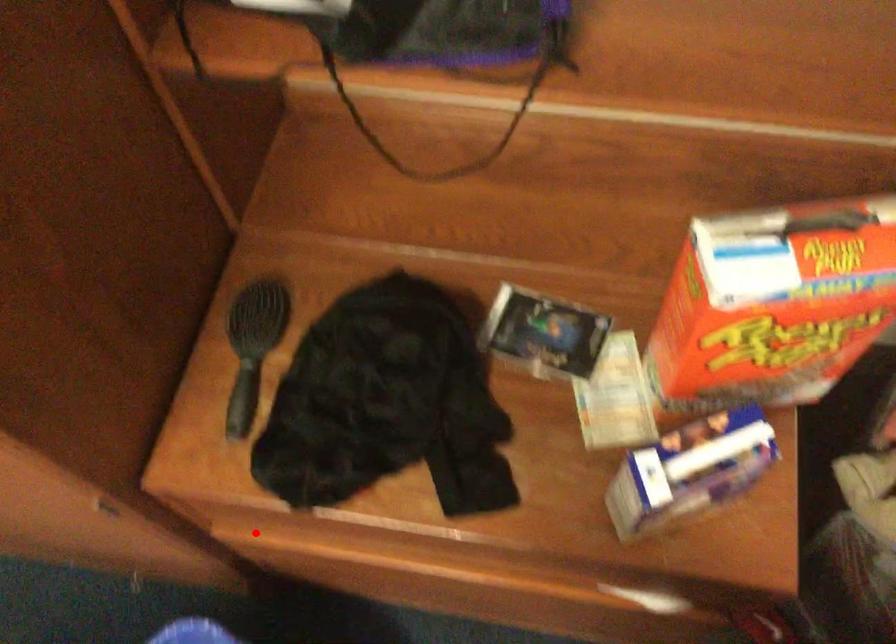
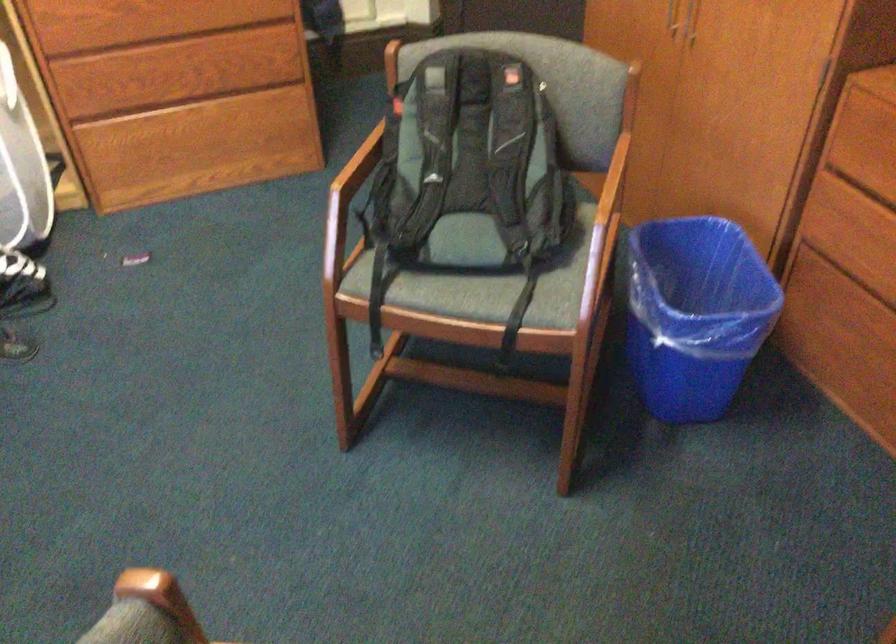
The point at the highlighted location is marked in the first image. Where is the corresponding point in the second image?

(864, 161)